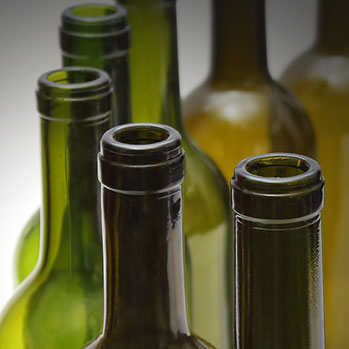
This screenshot has height=349, width=349. Identify the location of bottle. (25, 255).